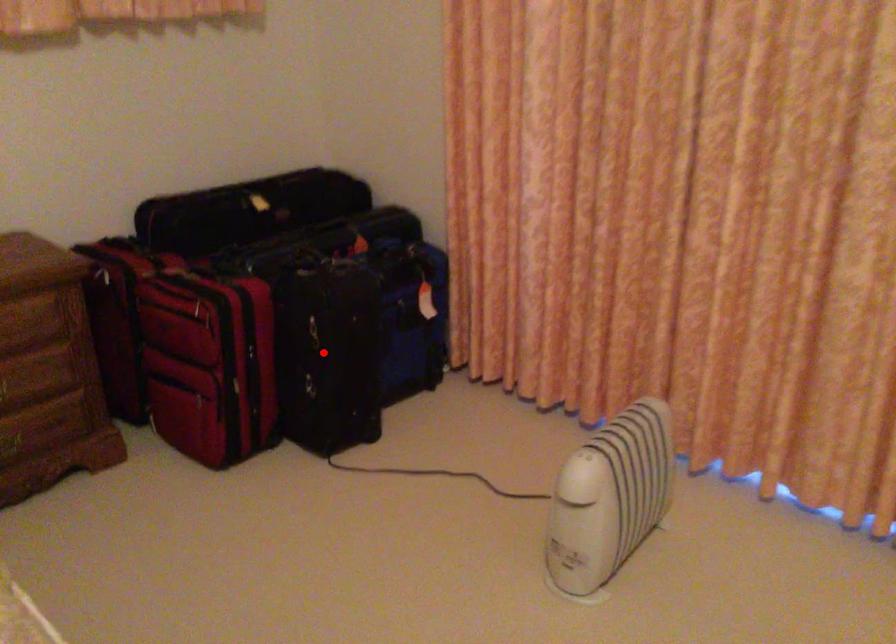
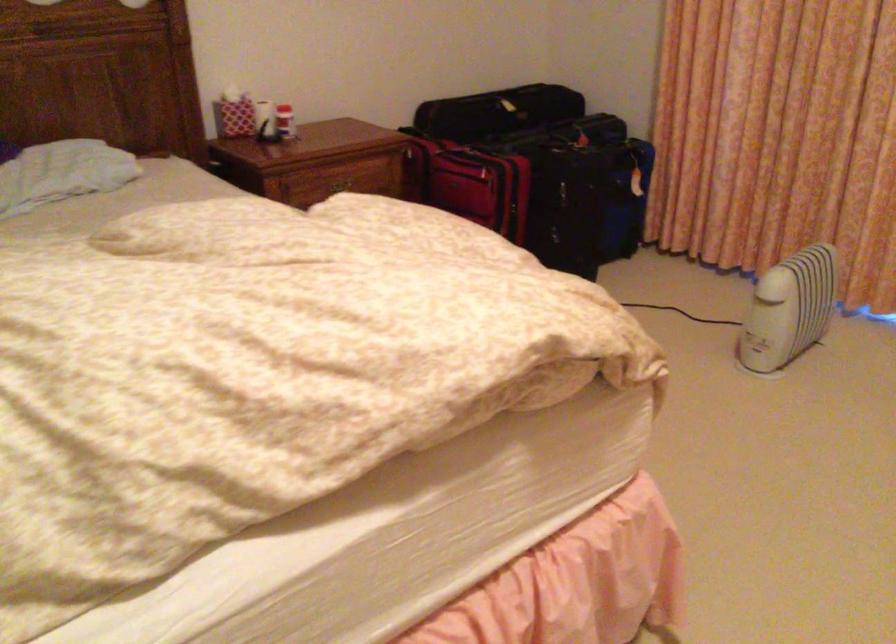
Question: I am providing you with two images of the same scene from different viewpoints. In image1, a red point is highlighted. Considering the same 3D point in image2, which of the following is correct?

Choices:
 (A) It is closer
 (B) It is farther

Answer: (B)